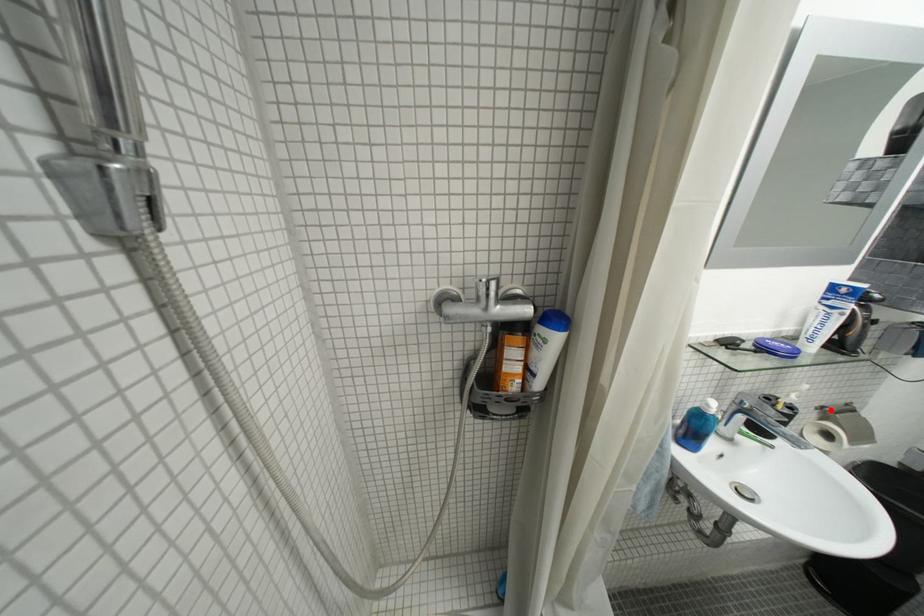
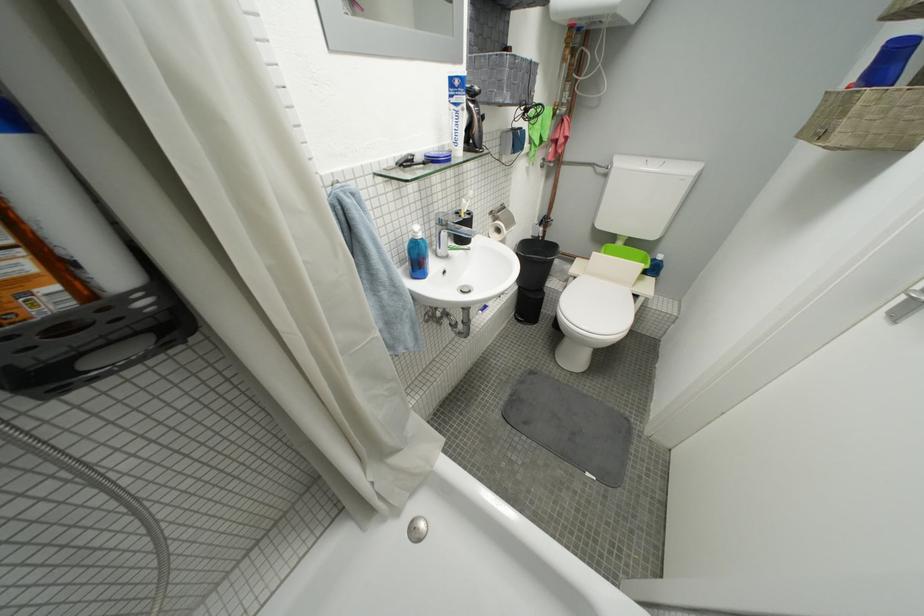
Find the pixel in the second image that matches the highlighted location in the first image.

(500, 214)